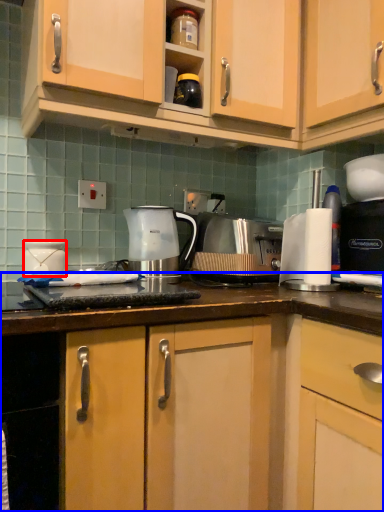
Question: Which object is further to the camera taking this photo, appliance (highlighted by a red box) or countertop (highlighted by a blue box)?

Choices:
 (A) appliance
 (B) countertop

Answer: (A)